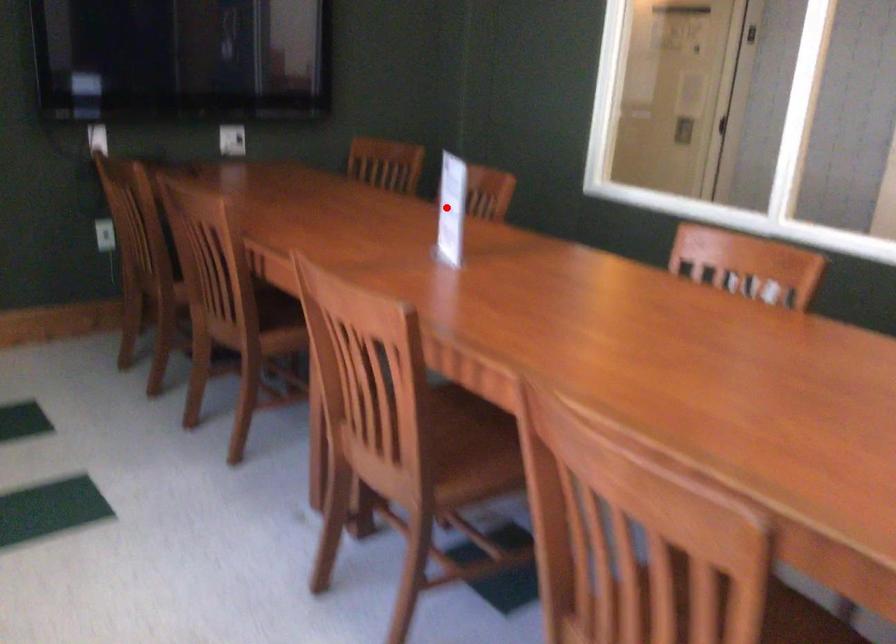
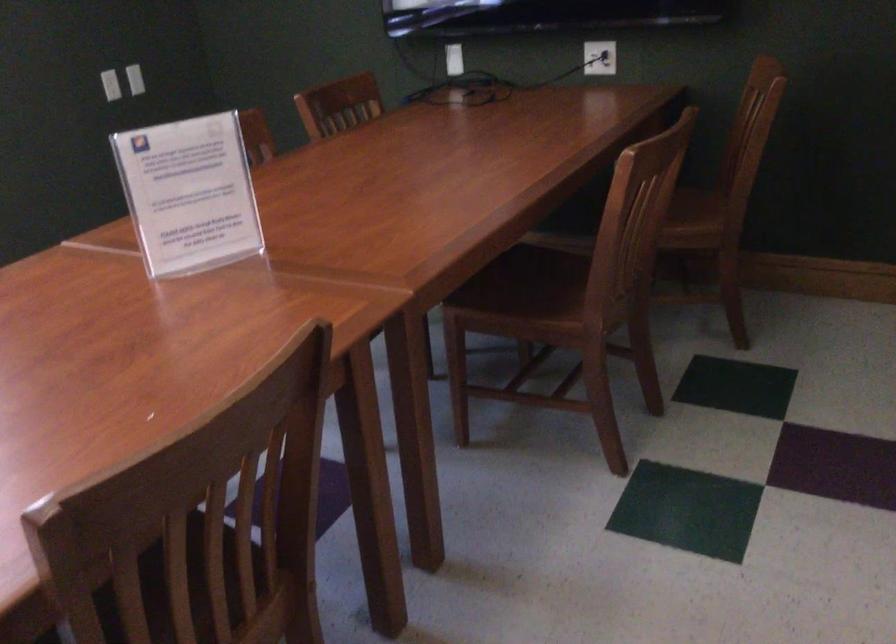
The point at the highlighted location is marked in the first image. Where is the corresponding point in the second image?

(188, 194)